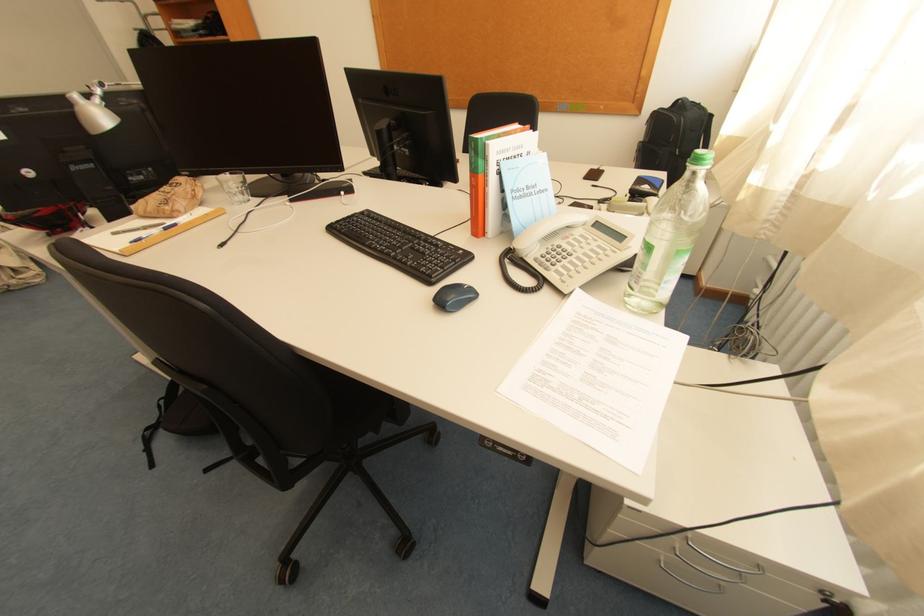
Which object does [399,246] point to?

It corresponds to the black keyboard in the image.